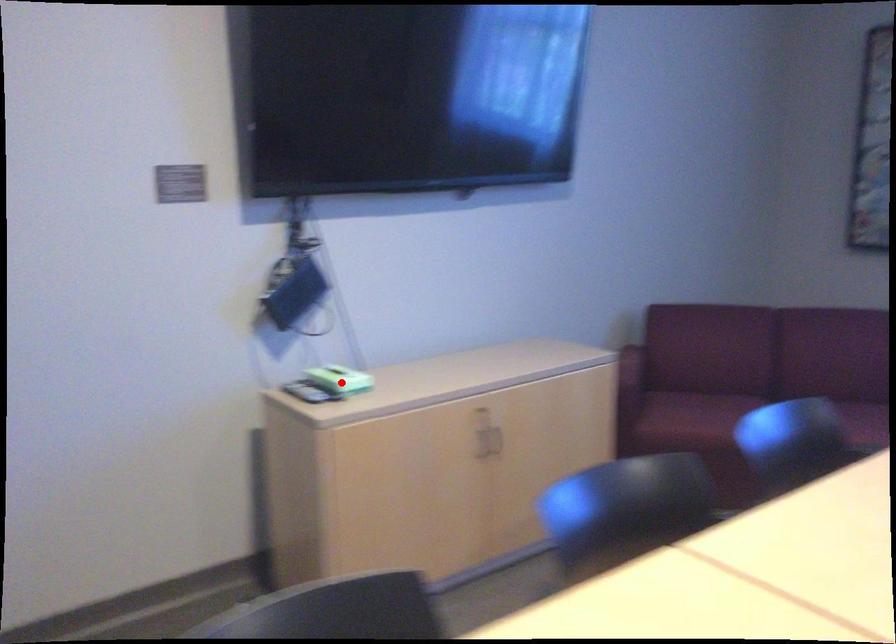
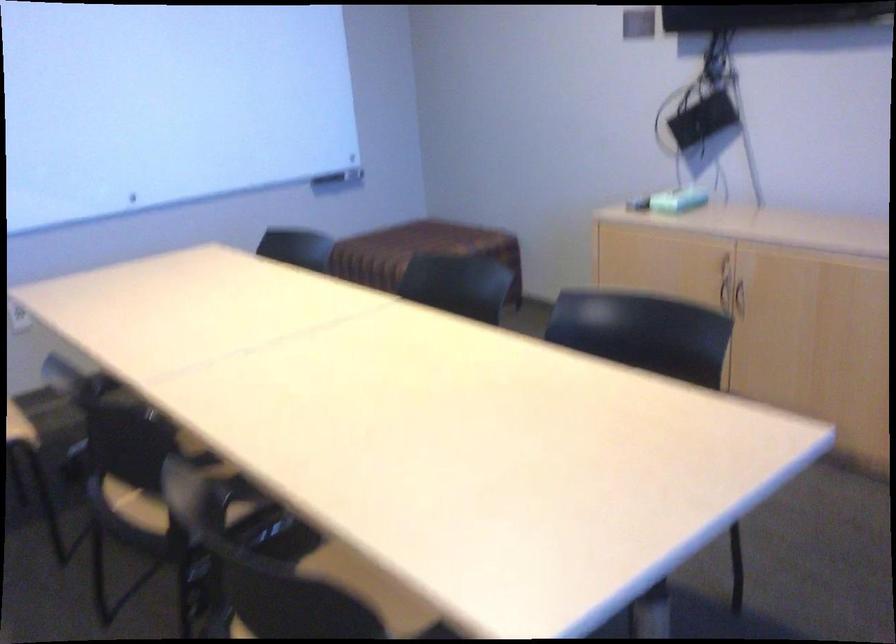
Locate, in the second image, the point that corresponds to the highlighted location in the first image.

(677, 200)